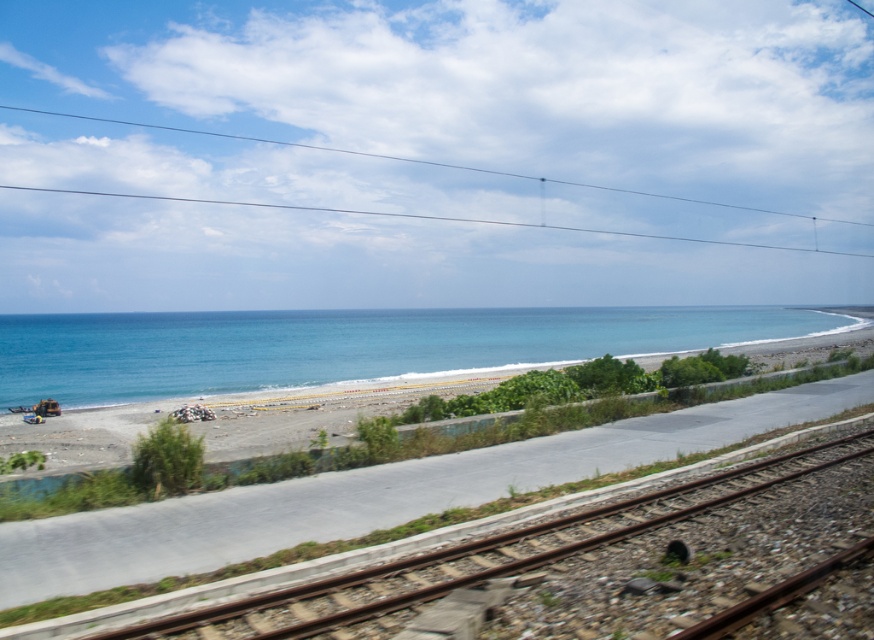
Question: Among these objects, which one is nearest to the camera?

Choices:
 (A) smooth sand beach at lower left
 (B) brown rusted metal track at lower center

Answer: (B)

Question: Is blue glossy water at left in front of brown rusted metal track at lower center?

Choices:
 (A) yes
 (B) no

Answer: (B)

Question: Does smooth sand beach at lower left appear over blue glossy water at left?

Choices:
 (A) no
 (B) yes

Answer: (B)

Question: Which object is positioned farthest from the smooth sand beach at lower left?

Choices:
 (A) brown rusted metal track at lower center
 (B) blue glossy water at left

Answer: (A)

Question: Among these objects, which one is farthest from the camera?

Choices:
 (A) blue glossy water at left
 (B) brown rusted metal track at lower center

Answer: (A)

Question: Can you confirm if smooth sand beach at lower left is smaller than blue glossy water at left?

Choices:
 (A) no
 (B) yes

Answer: (B)